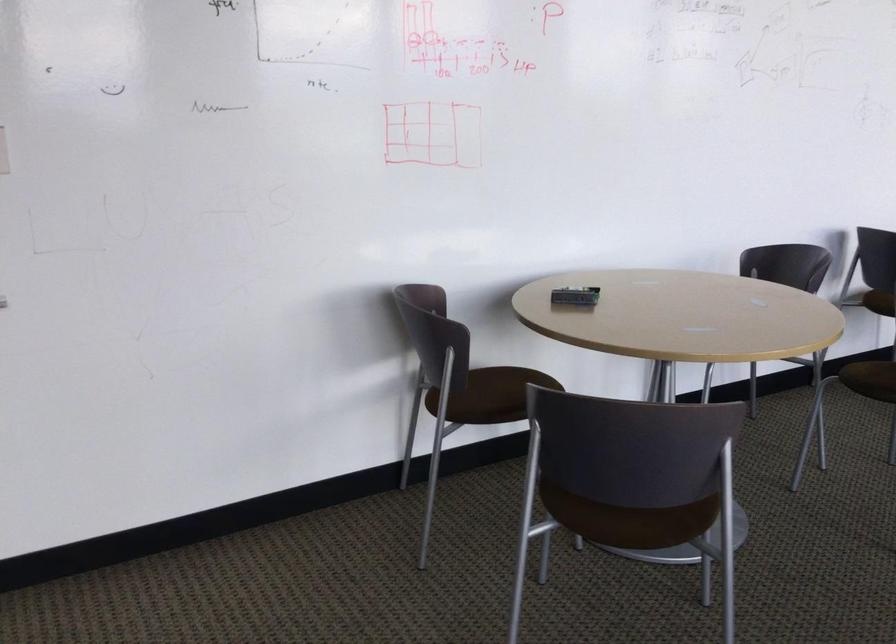
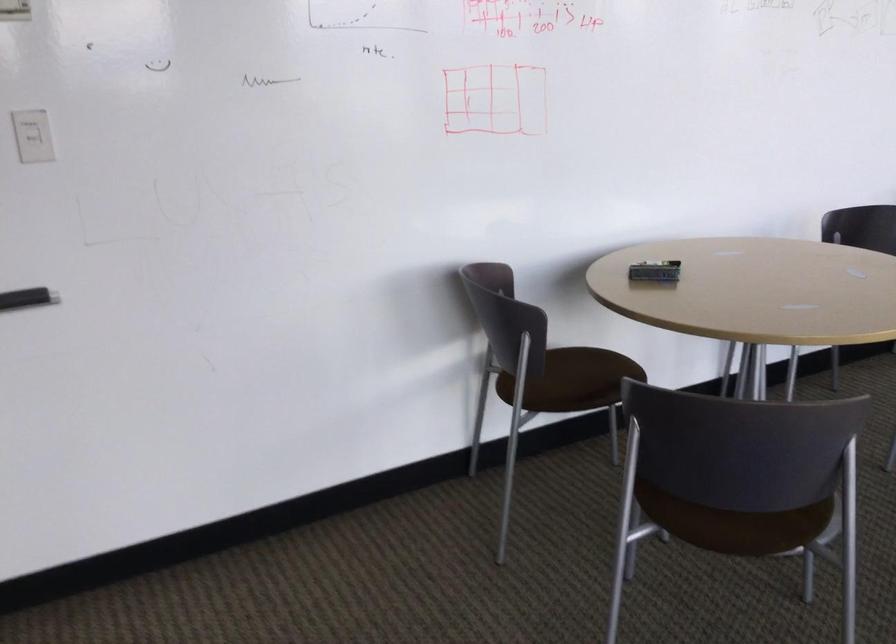
Question: The first image is from the beginning of the video and the second image is from the end. How did the camera likely rotate when shooting the video?

Choices:
 (A) Left
 (B) Right
 (C) Up
 (D) Down

Answer: (D)